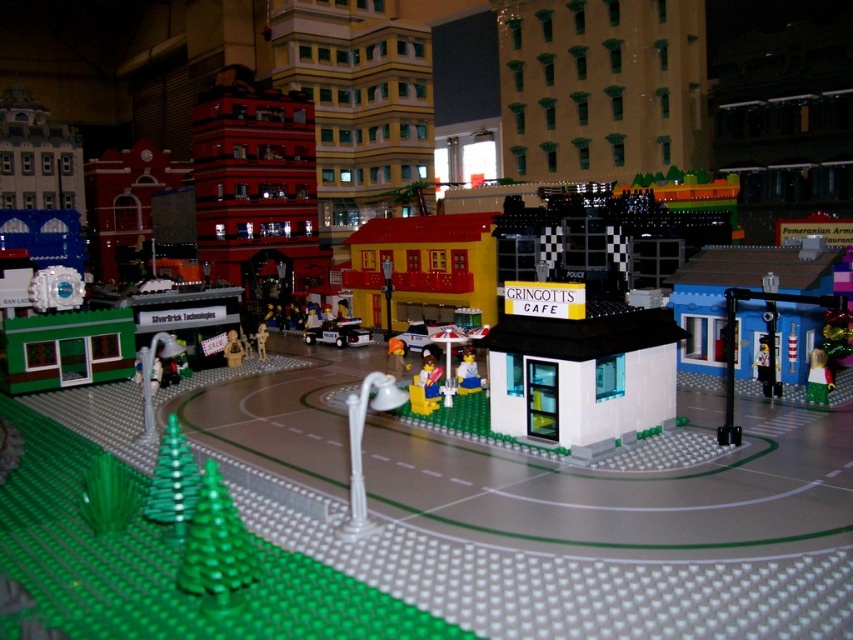
You are standing in the Lego cityscape and want to reach the point at coordinates (202, 524). The point is 1.39 meters away from you. If you have a toy car that can travel 2 meters per second, how long will it take for the car to reach the point?

The point at coordinates (202, 524) is 1.39 meters away. Since the toy car travels at 2 meters per second, it will take approximately 0.695 seconds to reach the point.

You are a delivery drone trying to navigate through the Lego cityscape. You need to drop off a package at the Gringotts Cafe. The cafe is located at the central part of the image. There is a circular road with green Lego trees on the left side. Your current position is at point (218,548). Can you confirm if you are currently above the green plastic trees at lower left?

Yes, the point (218,548) corresponds to the green plastic trees at lower left, so you are currently above the green plastic trees at lower left.

You are a Lego figure standing at the entrance of Gringotts Cafe. You want to place a new decoration on the green matte christmas tree at lower left. However, there is a white plastic street lamp at center above it. Can you reach the tree without touching the lamp?

The green matte christmas tree at lower left is positioned under the white plastic street lamp at center, so you can reach the tree without touching the lamp as it is located below it.